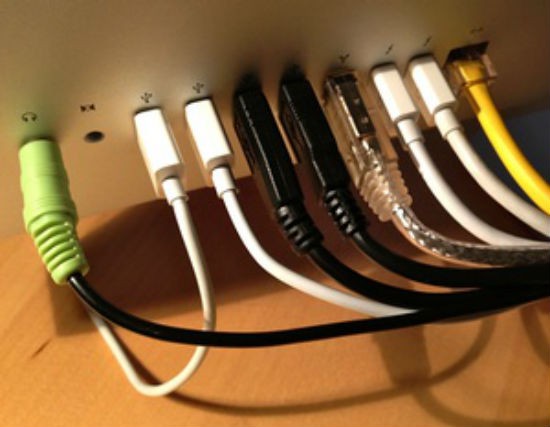
This screenshot has height=427, width=550. What are the coordinates of `wires` in the screenshot? It's located at (138, 327), (209, 299), (269, 270), (339, 270), (385, 252), (419, 238), (463, 225), (499, 197), (529, 176).